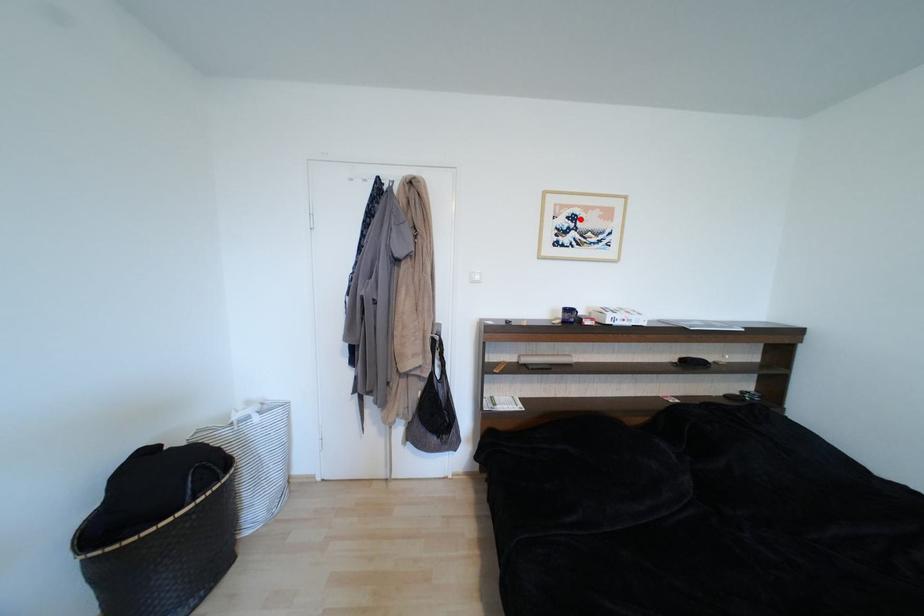
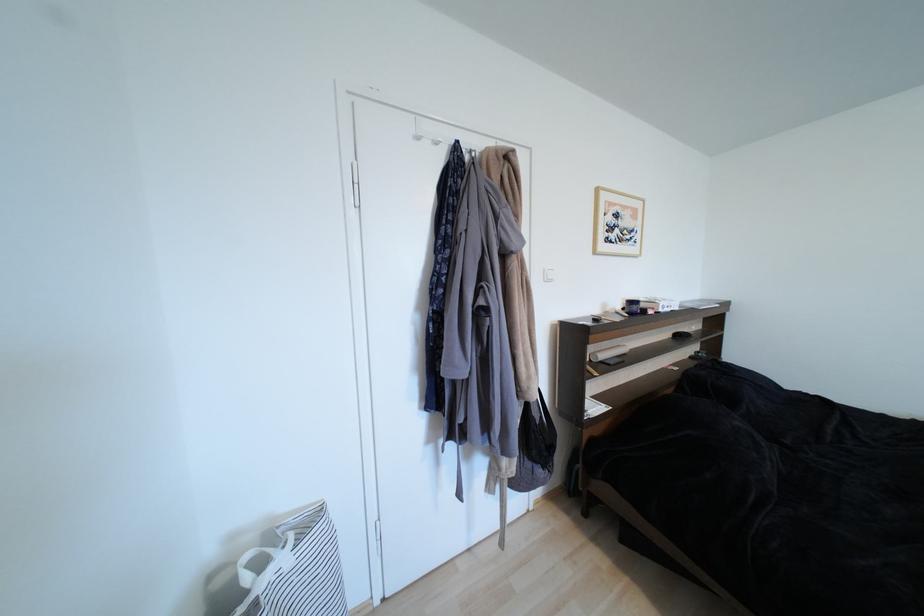
In the second image, find the point that corresponds to the highlighted location in the first image.

(623, 217)